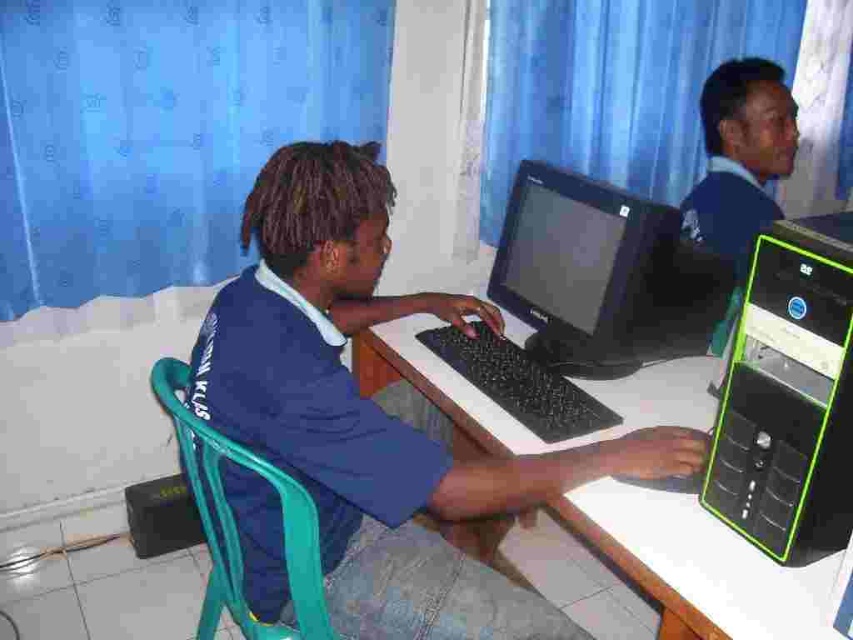
Measure the distance from black plastic computer at center to matte black laptop at upper right.

black plastic computer at center is 27.25 inches from matte black laptop at upper right.

Is point (850, 499) positioned before point (688, 212)?

Yes, point (850, 499) is in front of point (688, 212).

You are a GUI agent. You are given a task and a screenshot of the screen. Output one action in this format:
    pyautogui.click(x=<x>, y=<y>)
    Task: Click on the black plastic computer at center
    The width and height of the screenshot is (853, 640).
    Given the screenshot: What is the action you would take?
    pyautogui.click(x=788, y=396)

Does black plastic monitor at center have a larger size compared to black plastic keyboard at center?

Correct, black plastic monitor at center is larger in size than black plastic keyboard at center.

Which is in front, point (579, 205) or point (512, 344)?

Positioned in front is point (579, 205).

Which is in front, point (613, 374) or point (497, 387)?

Point (497, 387)

At what (x,y) coordinates should I click in order to perform the action: click on black plastic monitor at center. Please return your answer as a coordinate pair (x, y). Image resolution: width=853 pixels, height=640 pixels. Looking at the image, I should click on (602, 275).

Describe the element at coordinates (376, 412) in the screenshot. I see `blue fabric shirt at center` at that location.

Is blue fabric shirt at center bigger than black plastic monitor at center?

Yes, blue fabric shirt at center is bigger than black plastic monitor at center.

Identify the location of blue fabric shirt at center. This screenshot has height=640, width=853. (376, 412).

Identify the location of blue fabric shirt at center. This screenshot has height=640, width=853. (376, 412).